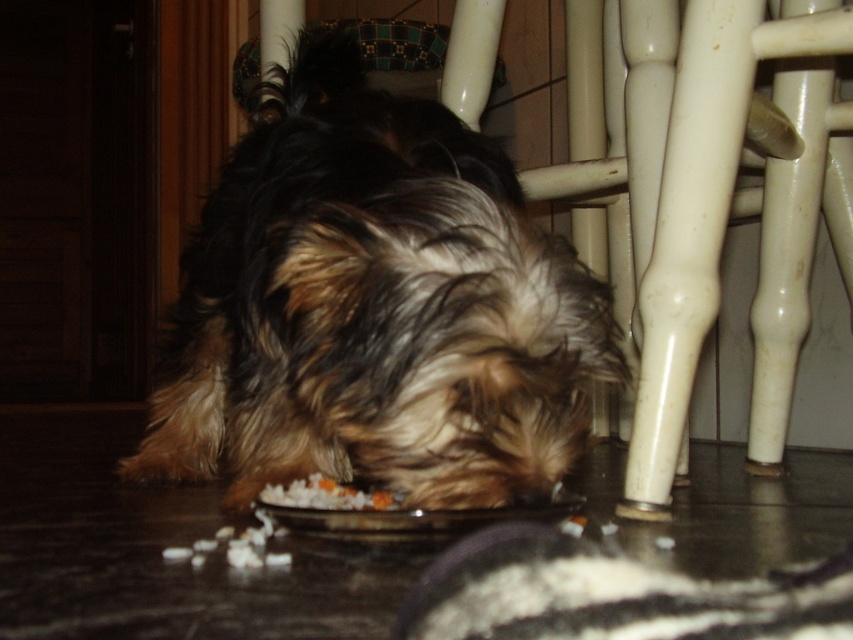
Can you confirm if shaggy brown fur at center is positioned below white crumbly food at lower center?

No, shaggy brown fur at center is not below white crumbly food at lower center.

Who is positioned more to the right, shaggy brown fur at center or white crumbly food at lower center?

shaggy brown fur at center

Who is more forward, (463, 412) or (368, 500)?

Point (463, 412) is in front.

Identify the location of shaggy brown fur at center. (374, 308).